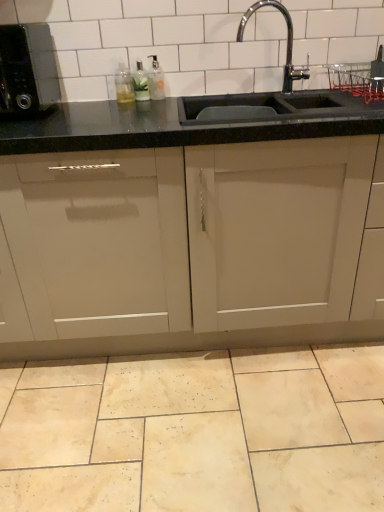
Image resolution: width=384 pixels, height=512 pixels. In order to click on vacant area that lies to the right of translucent glass bottle at upper left, the second bottle when ordered from right to left in this screenshot , I will do `click(178, 102)`.